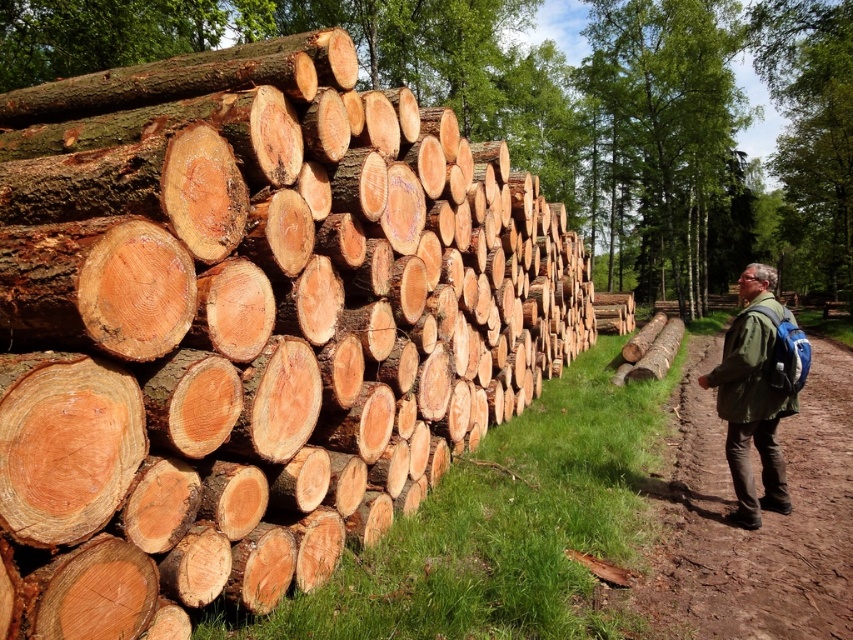
You are a hiker who wants to know which object is taller between the natural wood logs at left and the green leafy tree at upper center. Based on the scene, which one is taller?

The green leafy tree at upper center is taller than the natural wood logs at left.

You are standing at the center of the dirt path to the right of the image. You want to move to the natural wood logs at left. Which direction should you walk to reach them?

You should walk to the left to reach the natural wood logs at left since they are positioned at point (248,324), which is to the left of your current position on the dirt path.